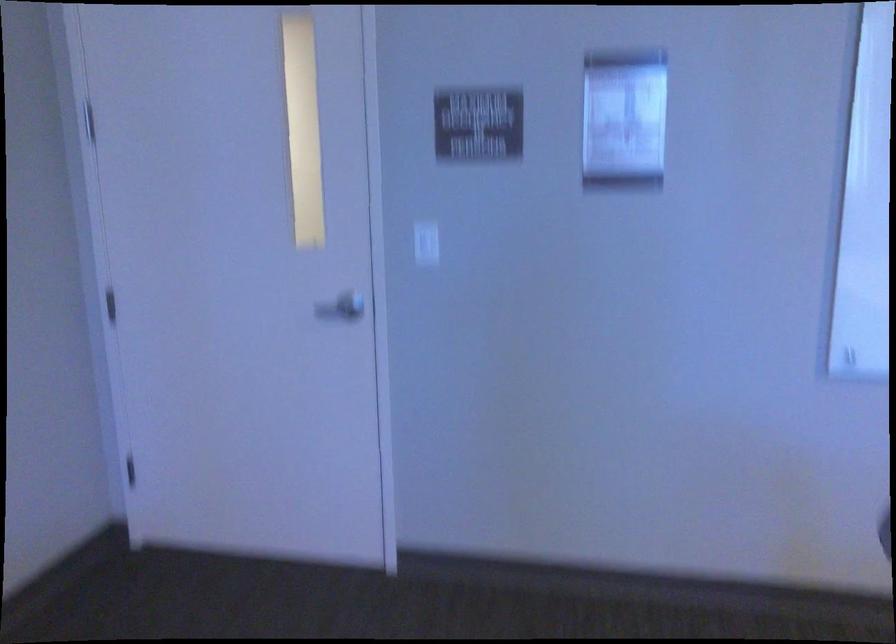
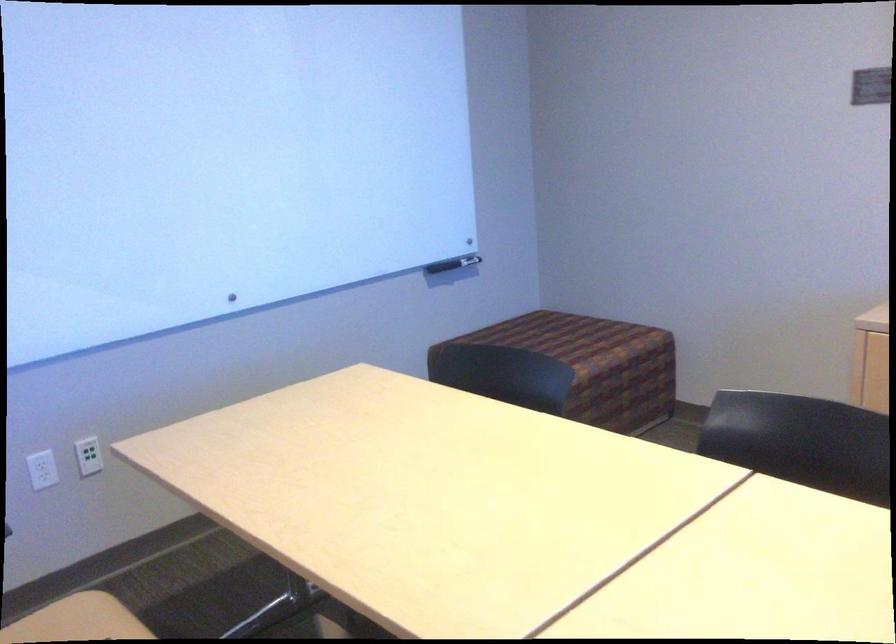
Question: The images are taken continuously from a first-person perspective. In which direction is your viewpoint rotating?

Choices:
 (A) Left
 (B) Right
 (C) Up
 (D) Down

Answer: (B)